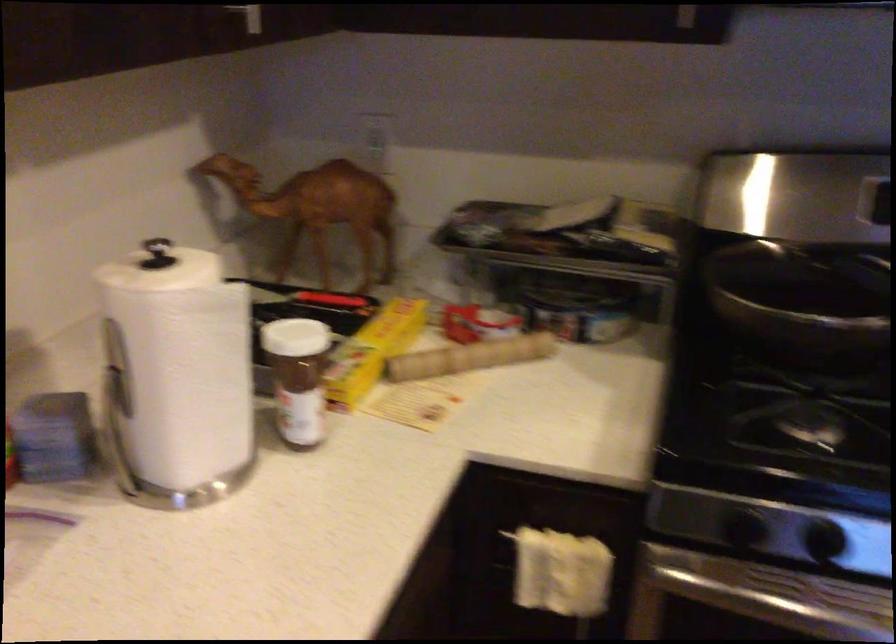
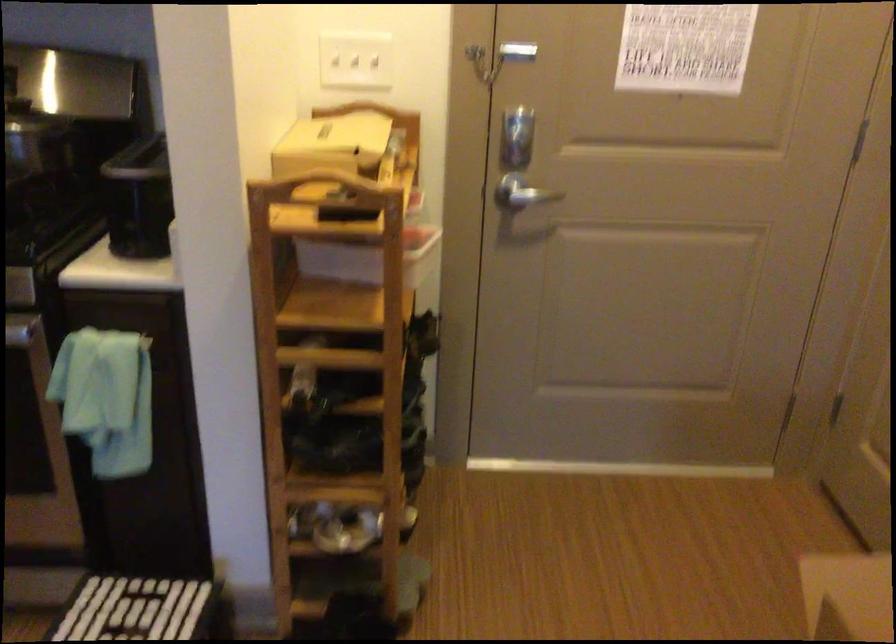
The images are taken continuously from a first-person perspective. In which direction are you moving?

The cameraman walked toward right, backward.